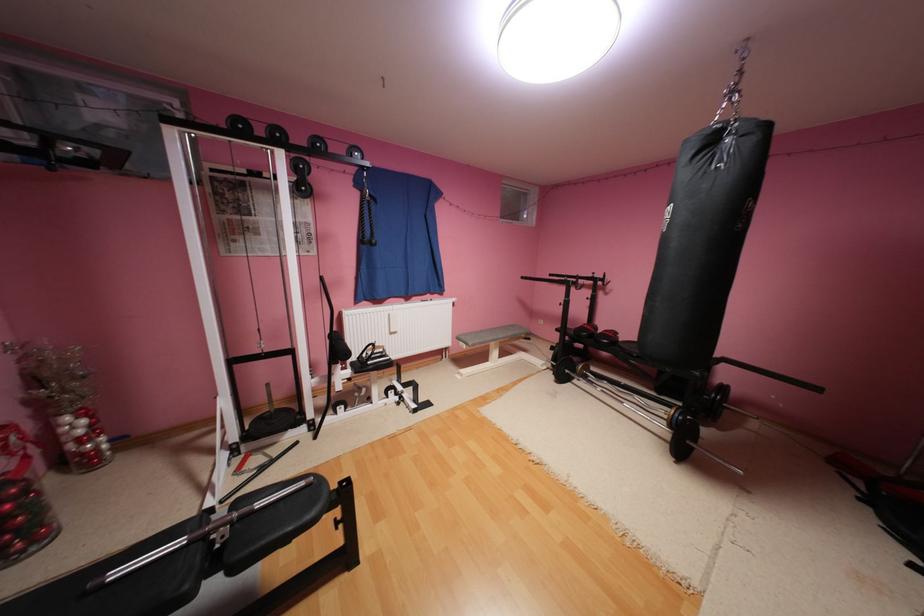
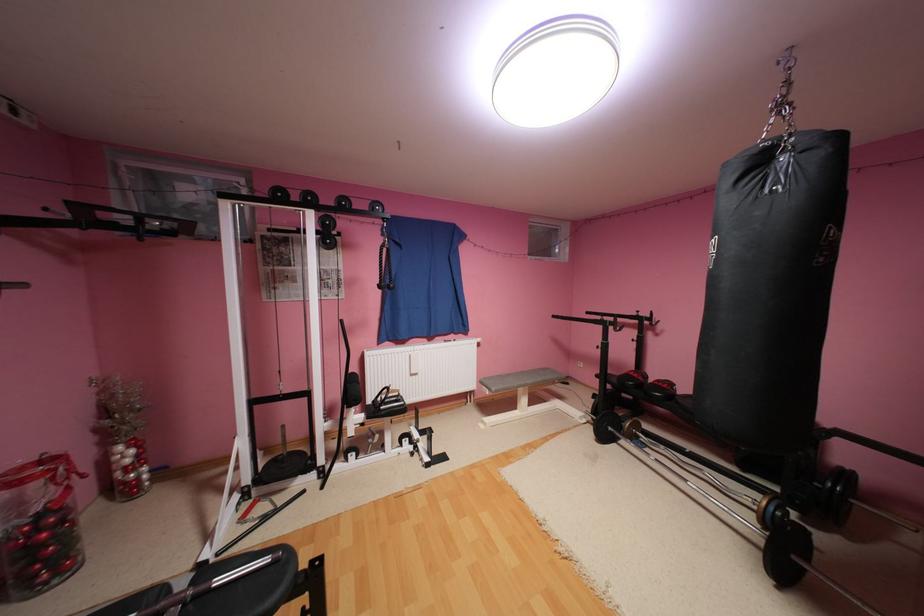
Question: Based on the continuous images, in which direction is the camera rotating? Reply with the corresponding letter.

Choices:
 (A) Left
 (B) Right
 (C) Up
 (D) Down

Answer: (A)